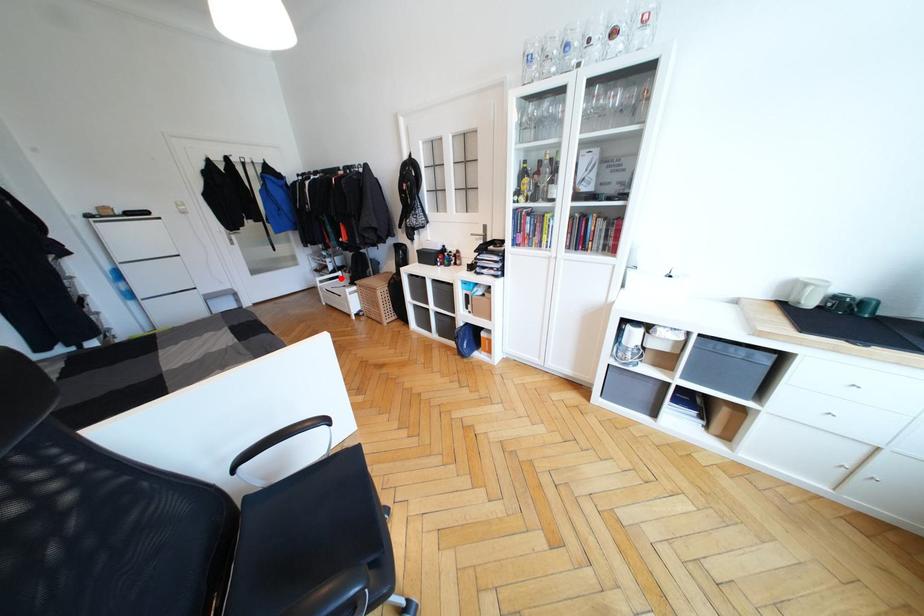
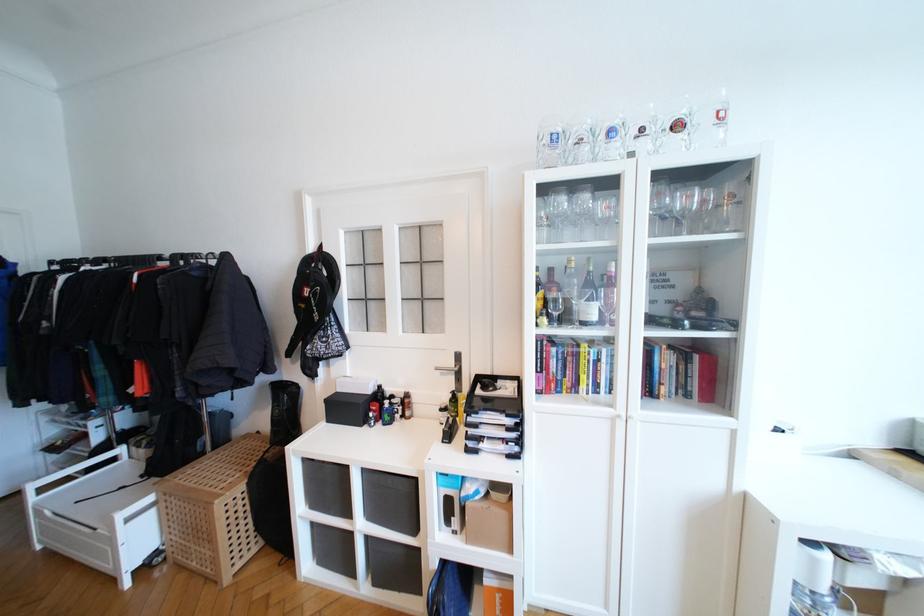
Question: A red point is marked in image1. In image2, is the corresponding 3D point closer to the camera or farther? Reply with the corresponding letter.

Choices:
 (A) The corresponding 3D point is closer.
 (B) The corresponding 3D point is farther.

Answer: (A)